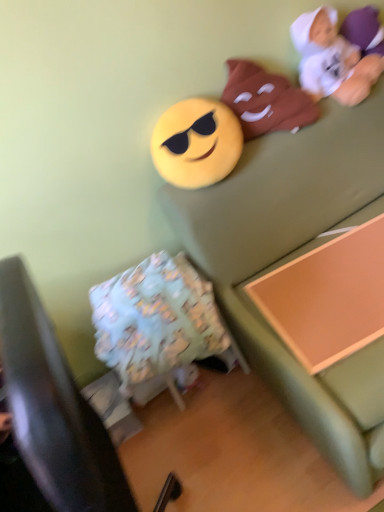
Question: Visually, is soft green couch at upper right positioned to the left or to the right of yellow matte emoji at upper center, which appears as the third toy when viewed from the right?

Choices:
 (A) left
 (B) right

Answer: (B)

Question: Is point (221, 297) positioned closer to the camera than point (170, 164)?

Choices:
 (A) closer
 (B) farther

Answer: (B)

Question: Estimate the real-world distances between objects in this image. Which object is farther from the matte brown plush at upper right, marked as the 2th toy in a left-to-right arrangement?

Choices:
 (A) soft green couch at upper right
 (B) light blue fabric bean bag chair at lower left
 (C) fluffy fabric pillow at lower left
 (D) orange wood changing table at lower right
 (E) yellow matte emoji at upper center, which is the 1th toy from left to right

Answer: (C)

Question: Which of these objects is positioned closest to the light blue fabric bean bag chair at lower left?

Choices:
 (A) white plush toy at upper right, arranged as the 3th toy when viewed from the left
 (B) matte brown plush at upper right, the 2th toy in the right-to-left sequence
 (C) soft green couch at upper right
 (D) yellow matte emoji at upper center, which appears as the third toy when viewed from the right
 (E) fluffy fabric pillow at lower left

Answer: (C)